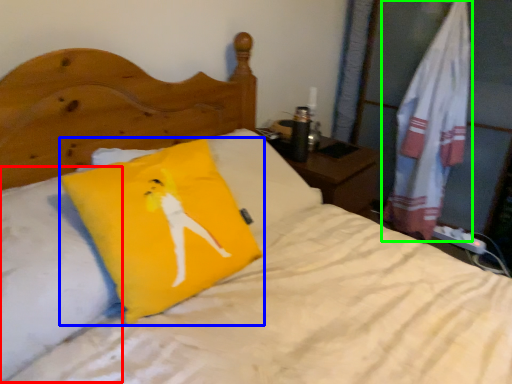
Question: Which object is the closest to the pillow (highlighted by a red box)? Choose among these: pillow (highlighted by a blue box) or material (highlighted by a green box).

Choices:
 (A) pillow
 (B) material

Answer: (A)